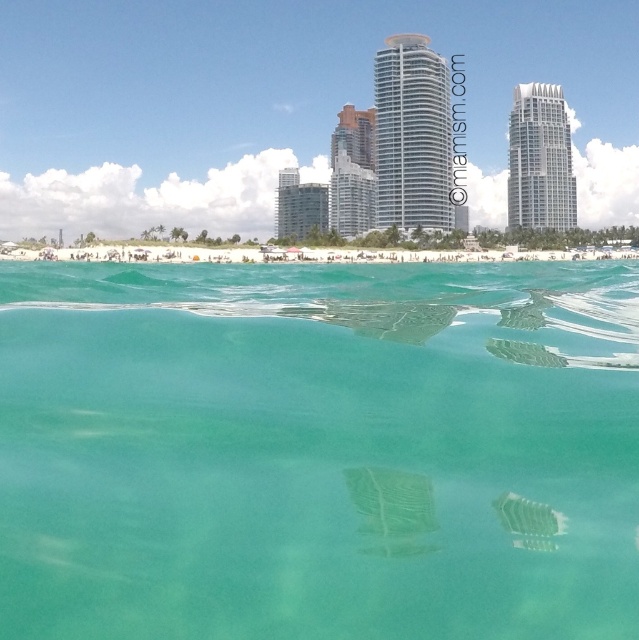
Question: Among these objects, which one is nearest to the camera?

Choices:
 (A) smooth glass building at center
 (B) smooth glass skyscraper at center

Answer: (A)

Question: Is clear glass water at center further to camera compared to white glassy building at upper center?

Choices:
 (A) yes
 (B) no

Answer: (B)

Question: Can you confirm if clear glass water at center is thinner than smooth glass building at center?

Choices:
 (A) yes
 (B) no

Answer: (B)

Question: Which point is closer to the camera?

Choices:
 (A) (351, 196)
 (B) (56, 316)
 (C) (410, 92)

Answer: (B)

Question: Which point is closer to the camera?

Choices:
 (A) smooth glass skyscraper at center
 (B) clear glass skyscraper at center
 (C) white glassy building at upper center
 (D) smooth glass building at center

Answer: (B)

Question: Is clear glass skyscraper at center thinner than smooth glass building at center?

Choices:
 (A) no
 (B) yes

Answer: (A)